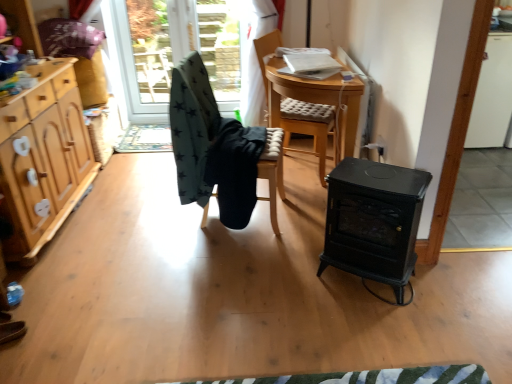
Locate an element on the screen. Image resolution: width=512 pixels, height=384 pixels. empty space that is ontop of black cast iron stove at center is located at coordinates (366, 172).